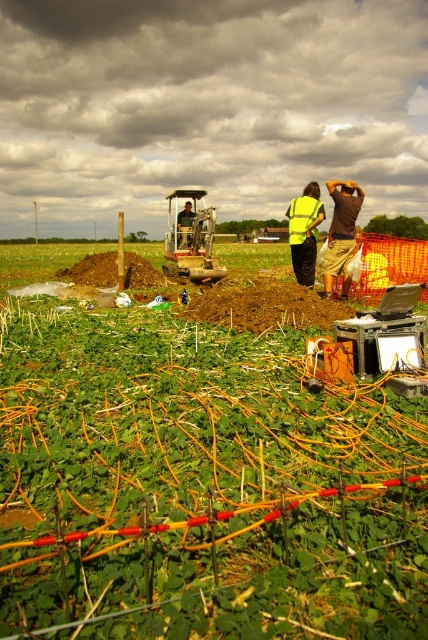
Question: Is green matte plant at center wider than metallic yellow tractor at center?

Choices:
 (A) no
 (B) yes

Answer: (B)

Question: Does metallic yellow tractor at center have a smaller size compared to high visibility yellow vest at center?

Choices:
 (A) no
 (B) yes

Answer: (A)

Question: Considering the real-world distances, which object is farthest from the metallic yellow tractor at center?

Choices:
 (A) green reflective vest at center
 (B) high visibility yellow safety vest at center

Answer: (B)

Question: Which of the following is the farthest from the observer?

Choices:
 (A) high visibility yellow safety vest at center
 (B) green reflective vest at center
 (C) metallic yellow tractor at center
 (D) high visibility yellow vest at center

Answer: (C)

Question: Does brown cotton shirt at upper right come in front of high visibility yellow vest at center?

Choices:
 (A) yes
 (B) no

Answer: (A)

Question: Based on their relative distances, which object is farther from the high visibility yellow vest at center?

Choices:
 (A) green matte plant at center
 (B) metallic yellow tractor at center
 (C) green reflective vest at center

Answer: (A)